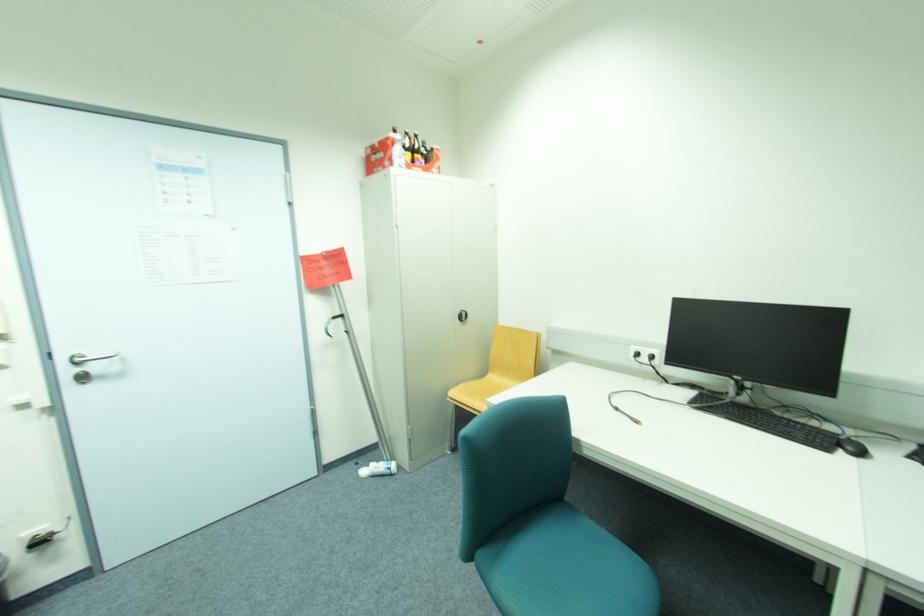
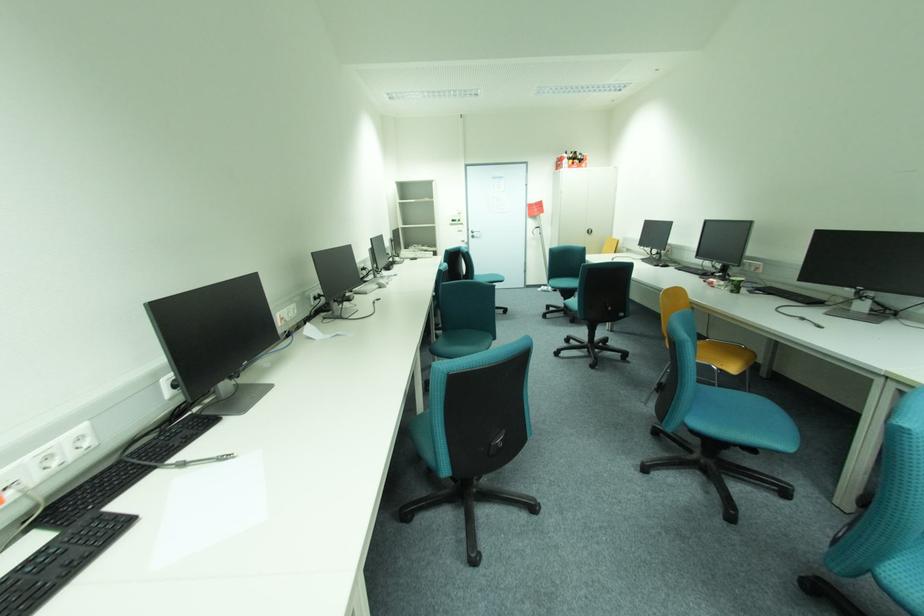
In the second image, find the point that corresponds to the point at 74,371 in the first image.

(477, 235)